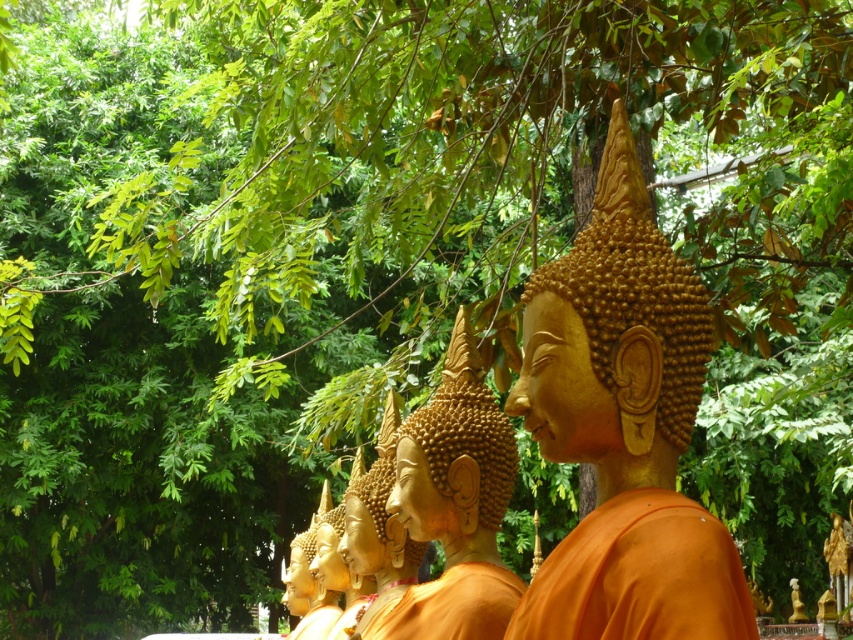
Is matte gold monk at center closer to the viewer compared to orange matte/soft fabric at center?

No.

The height and width of the screenshot is (640, 853). What do you see at coordinates (624, 428) in the screenshot? I see `matte gold monk at center` at bounding box center [624, 428].

I want to click on matte gold monk at center, so click(624, 428).

Looking at this image, is golden matte statue at center shorter than orange matte/soft fabric at center?

No.

The width and height of the screenshot is (853, 640). Describe the element at coordinates (454, 506) in the screenshot. I see `golden matte statue at center` at that location.

Image resolution: width=853 pixels, height=640 pixels. I want to click on golden matte statue at center, so click(454, 506).

Who is higher up, matte gold monk at center or golden matte statue at center?

matte gold monk at center

Is point (645, 614) positioned after point (437, 595)?

No, (645, 614) is closer to viewer.

This screenshot has width=853, height=640. What do you see at coordinates (624, 428) in the screenshot?
I see `matte gold monk at center` at bounding box center [624, 428].

Locate an element on the screen. matte gold monk at center is located at coordinates (624, 428).